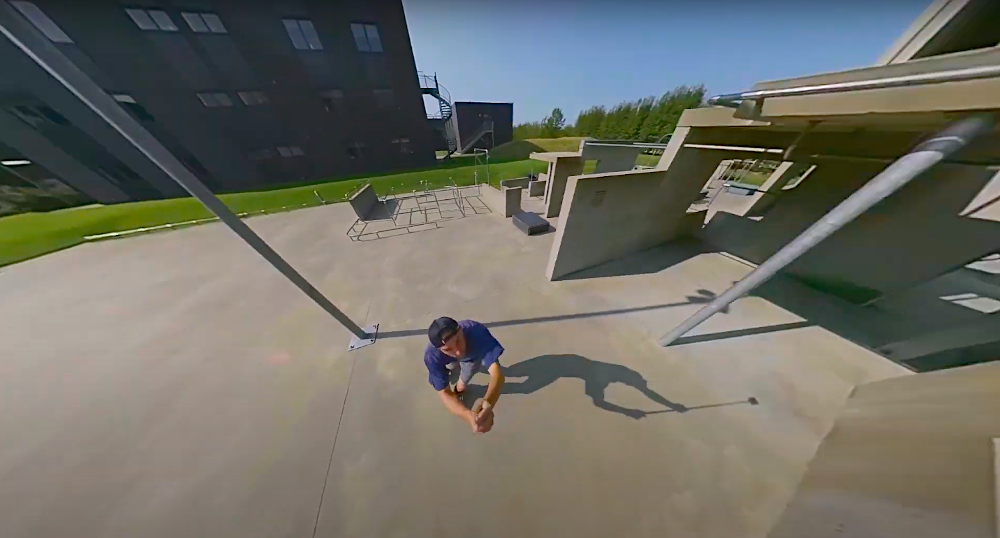
In order to click on stairs in this screenshot , I will do `click(446, 107)`, `click(482, 132)`.